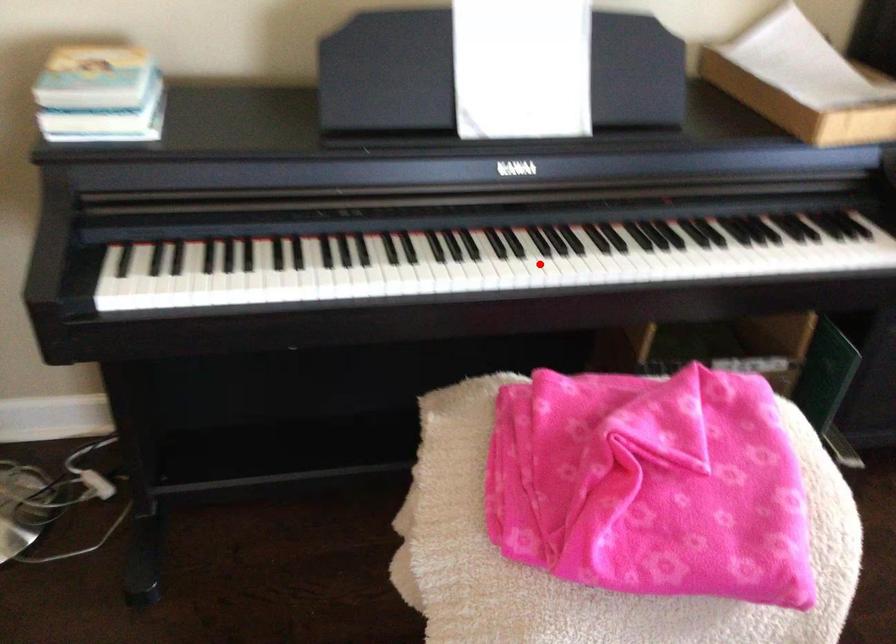
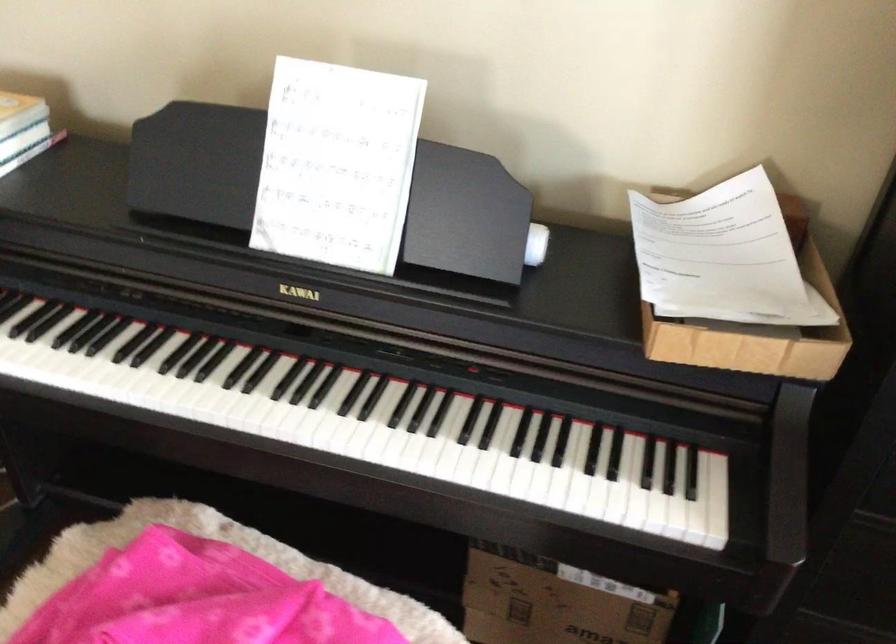
In the second image, find the point that corresponds to the highlighted location in the first image.

(245, 412)